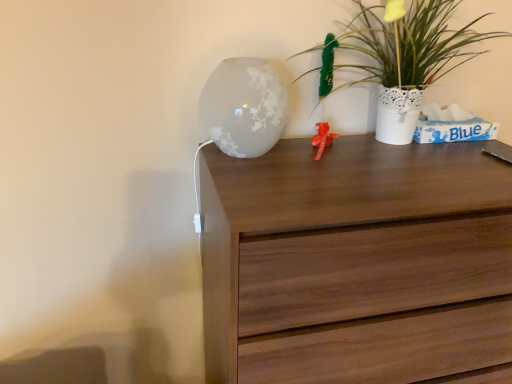
Locate an element on the screen. The width and height of the screenshot is (512, 384). free space in front of white textured vase at upper right is located at coordinates (382, 177).